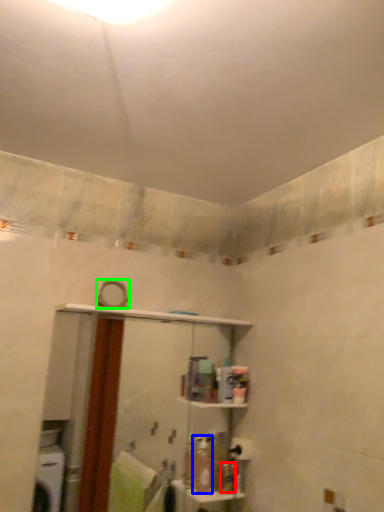
Question: Which is nearer to the toiletry (highlighted by a red box)? toiletry (highlighted by a blue box) or mirror (highlighted by a green box).

Choices:
 (A) toiletry
 (B) mirror

Answer: (A)